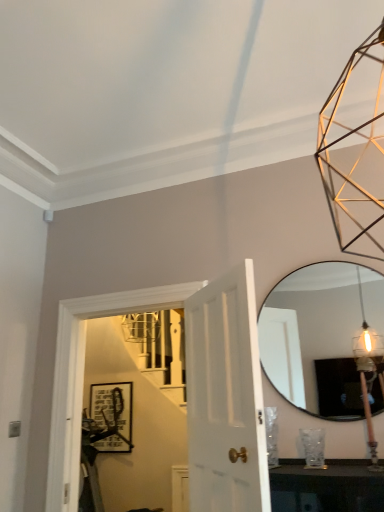
Question: Is wooden pole at right inside matte glass mirror at right?

Choices:
 (A) no
 (B) yes

Answer: (A)

Question: Can you confirm if matte glass mirror at right is positioned to the left of wooden pole at right?

Choices:
 (A) yes
 (B) no

Answer: (A)

Question: Considering the relative sizes of matte glass mirror at right and wooden pole at right in the image provided, is matte glass mirror at right taller than wooden pole at right?

Choices:
 (A) no
 (B) yes

Answer: (B)

Question: Is matte glass mirror at right oriented away from wooden pole at right?

Choices:
 (A) no
 (B) yes

Answer: (A)

Question: Is matte glass mirror at right with wooden pole at right?

Choices:
 (A) no
 (B) yes

Answer: (A)

Question: From a real-world perspective, is matte glass mirror at right located beneath wooden pole at right?

Choices:
 (A) yes
 (B) no

Answer: (B)

Question: Can we say wooden pole at right lies outside black matte picture frame at center?

Choices:
 (A) yes
 (B) no

Answer: (A)

Question: Is wooden pole at right in contact with black matte picture frame at center?

Choices:
 (A) no
 (B) yes

Answer: (A)

Question: Considering the relative sizes of wooden pole at right and black matte picture frame at center in the image provided, is wooden pole at right thinner than black matte picture frame at center?

Choices:
 (A) yes
 (B) no

Answer: (B)

Question: From a real-world perspective, is wooden pole at right beneath black matte picture frame at center?

Choices:
 (A) yes
 (B) no

Answer: (B)

Question: Can you confirm if wooden pole at right is positioned to the right of black matte picture frame at center?

Choices:
 (A) no
 (B) yes

Answer: (B)

Question: From the image's perspective, is wooden pole at right located beneath black matte picture frame at center?

Choices:
 (A) yes
 (B) no

Answer: (B)

Question: Does matte glass mirror at right have a lesser height compared to black matte picture frame at center?

Choices:
 (A) no
 (B) yes

Answer: (A)